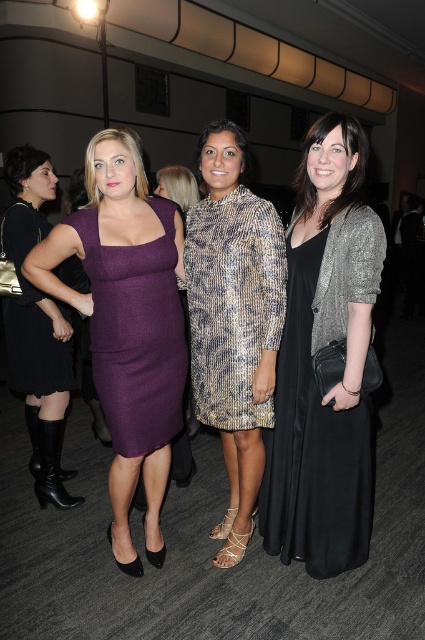
Question: Which of the following is the closest to the observer?

Choices:
 (A) (170, 250)
 (B) (266, 323)

Answer: (B)

Question: Can you confirm if black satin dress at center is wider than black leather boots at lower left?

Choices:
 (A) yes
 (B) no

Answer: (A)

Question: Which object is positioned farthest from the matte purple dress at center?

Choices:
 (A) black satin dress at center
 (B) black matte dress at left
 (C) black leather boots at lower left
 (D) purple wool dress at center

Answer: (B)

Question: Which object is farther from the camera taking this photo?

Choices:
 (A) black leather boots at lower left
 (B) black satin dress at center
 (C) gold sequined dress at center

Answer: (A)

Question: Is gold sequined dress at center thinner than black matte dress at left?

Choices:
 (A) yes
 (B) no

Answer: (A)

Question: Can you confirm if matte purple dress at center is thinner than gold sequined dress at center?

Choices:
 (A) no
 (B) yes

Answer: (A)